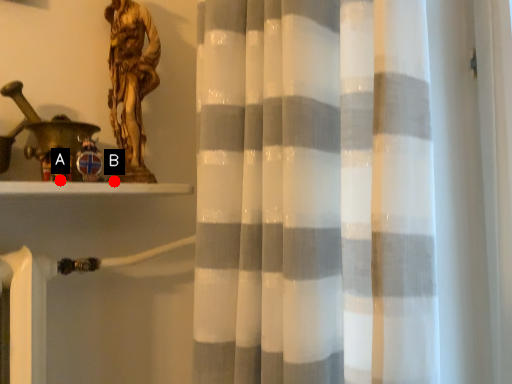
Question: Two points are circled on the image, labeled by A and B beside each circle. Which point appears farthest from the camera in this image?

Choices:
 (A) A is further
 (B) B is further

Answer: (B)